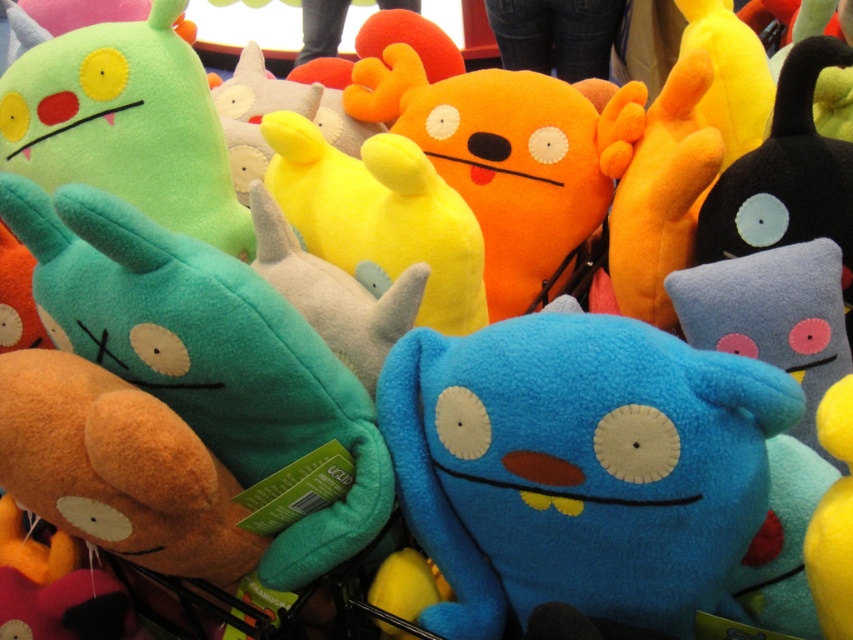
Is blue plush toy at center further to camera compared to teal plush toy at center-left?

No, it is in front of teal plush toy at center-left.

Locate an element on the screen. blue plush toy at center is located at coordinates (579, 468).

Can you confirm if blue plush toy at center is bigger than orange plush toy at center?

Actually, blue plush toy at center might be smaller than orange plush toy at center.

Which of these two, blue plush toy at center or orange plush toy at center, stands shorter?

Standing shorter between the two is blue plush toy at center.

Identify the location of blue plush toy at center. (579, 468).

Image resolution: width=853 pixels, height=640 pixels. What are the coordinates of `blue plush toy at center` in the screenshot? It's located at (579, 468).

Based on the photo, which of these two, teal plush toy at center-left or orange plush toy at center, stands shorter?

A: Standing shorter between the two is teal plush toy at center-left.

Between teal plush toy at center-left and orange plush toy at center, which one is positioned lower?

Positioned lower is teal plush toy at center-left.

Who is more forward, (x=325, y=524) or (x=469, y=188)?

Positioned in front is point (x=325, y=524).

The width and height of the screenshot is (853, 640). In order to click on teal plush toy at center-left in this screenshot , I will do `click(206, 356)`.